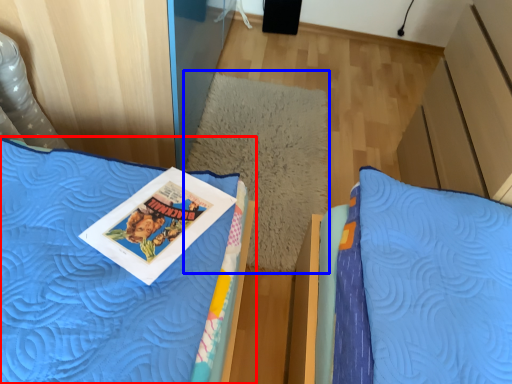
Question: Which object is further to the camera taking this photo, bed (highlighted by a red box) or pillow (highlighted by a blue box)?

Choices:
 (A) bed
 (B) pillow

Answer: (B)